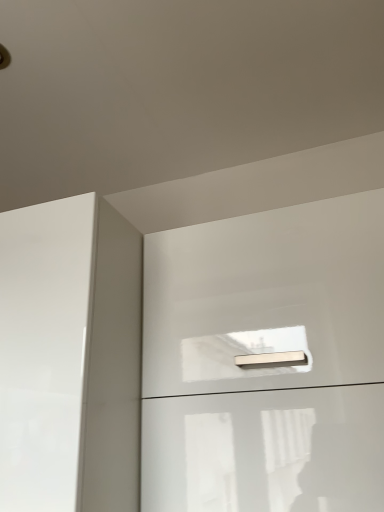
The image size is (384, 512). Describe the element at coordinates (266, 361) in the screenshot. I see `glossy white file cabinet at upper center` at that location.

Measure the distance between point (191, 227) and camera.

They are 1.06 meters apart.

Identify the location of glossy white file cabinet at upper center. (266, 361).

What is the approximate width of glossy white file cabinet at upper center?

The width of glossy white file cabinet at upper center is 17.47 inches.

Image resolution: width=384 pixels, height=512 pixels. In order to click on glossy white file cabinet at upper center in this screenshot , I will do `click(266, 361)`.